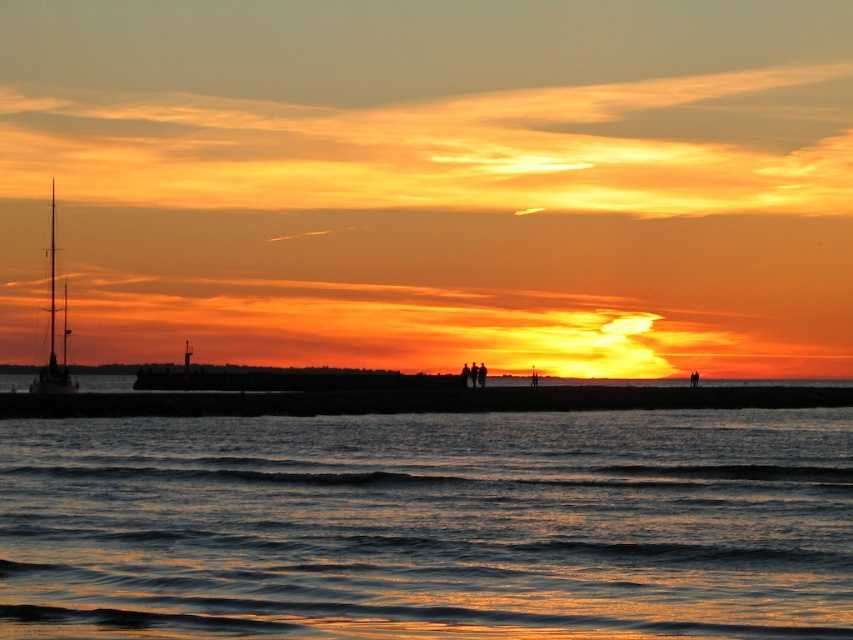
You are standing on the beach and want to take a photo of the shiny metallic sailboat at left and the shiny metallic water at lower center. If your camera can focus on objects within 30 meters, will both objects be in focus at the same time?

The shiny metallic water at lower center is 34.70 meters away from the shiny metallic sailboat at left. Since the distance between them is beyond the camera focus range of 30 meters, both objects cannot be in focus simultaneously.

You are standing on the beach looking at the scene. Which object, the shiny metallic water at lower center or the shiny metallic sailboat at left, is nearer to you?

The shiny metallic water at lower center is closer to the viewer than the shiny metallic sailboat at left.